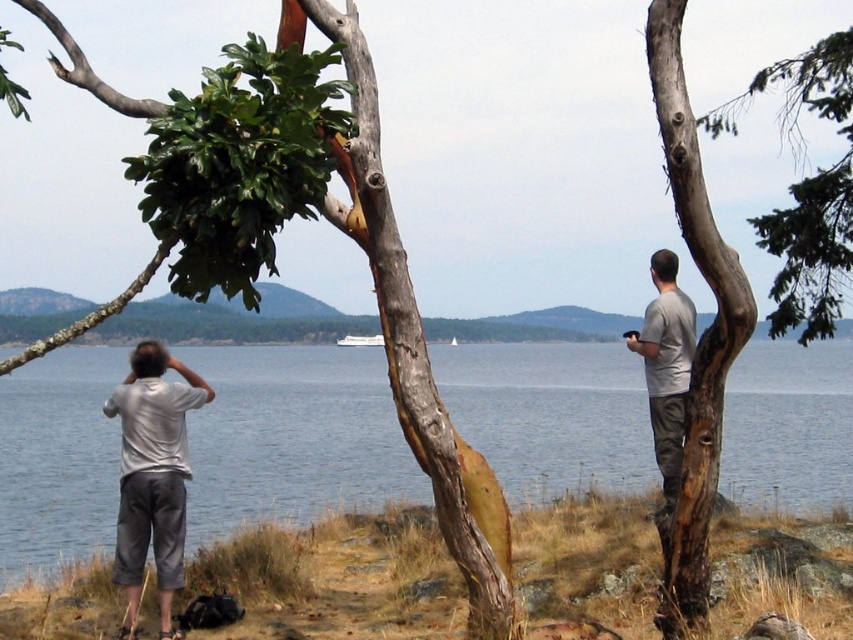
Does point (451, 586) lie in front of point (671, 500)?

No.

Which is behind, point (294, 616) or point (656, 280)?

The point (294, 616) is more distant.

What are the coordinates of `brown grass at lower center` in the screenshot? It's located at (335, 579).

Between smooth bark tree trunk at right and gray matte shirt at right, which one appears on the right side from the viewer's perspective?

Positioned to the right is smooth bark tree trunk at right.

Is point (790, 266) positioned before point (659, 404)?

No, it is not.

Find the location of a particular element. The width and height of the screenshot is (853, 640). smooth bark tree trunk at right is located at coordinates (805, 189).

Can you confirm if blue water at center is wider than gray matte shirt at right?

Correct, the width of blue water at center exceeds that of gray matte shirt at right.

Is blue water at center bigger than gray matte shirt at right?

Yes, blue water at center is bigger than gray matte shirt at right.

At what (x,y) coordinates should I click in order to perform the action: click on blue water at center. Please return your answer as a coordinate pair (x, y). This screenshot has height=640, width=853. Looking at the image, I should click on (292, 436).